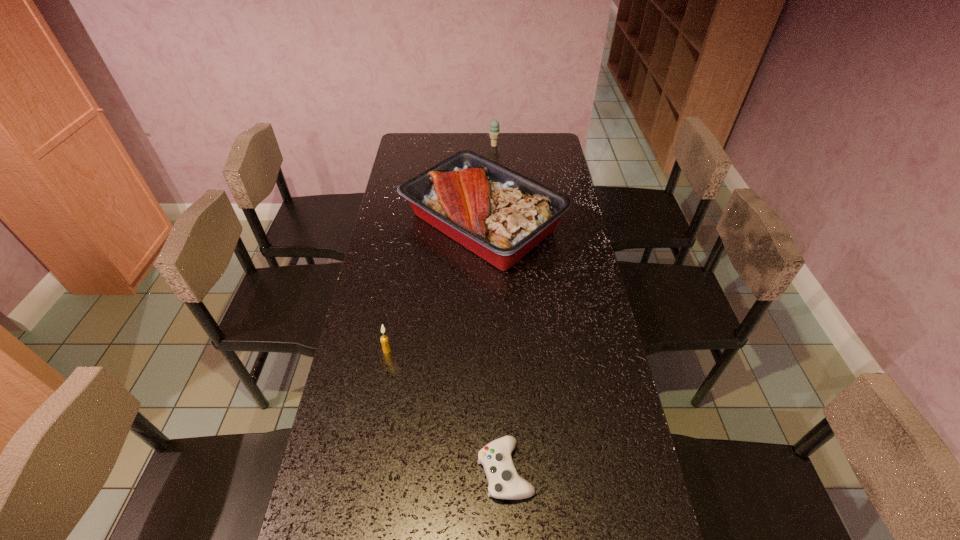
This screenshot has width=960, height=540. I want to click on blank region between the nearest object and the ice cream, so click(499, 308).

The image size is (960, 540). I want to click on vacant space that's between the second nearest object and the ice cream, so click(441, 248).

Find the location of a particular element. vacant area between the ice cream and the candle is located at coordinates (441, 248).

Identify the location of free space between the second farthest object and the second nearest object. (435, 286).

Locate an element on the screen. unoccupied area between the nearest object and the ice cream is located at coordinates (499, 308).

I want to click on free spot between the farthest object and the control, so click(x=499, y=308).

Find the location of a particular element. The width and height of the screenshot is (960, 540). vacant area between the shortest object and the ice cream is located at coordinates (499, 308).

I want to click on vacant space that's between the candle and the farthest object, so click(441, 248).

Locate an element on the screen. This screenshot has height=540, width=960. object that can be found as the third closest to the second nearest object is located at coordinates (494, 132).

I want to click on object that can be found as the third closest to the third nearest object, so click(x=504, y=482).